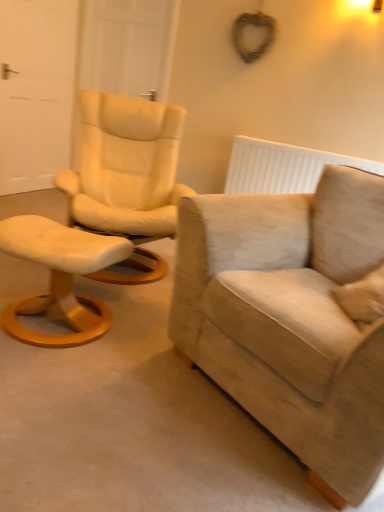
Question: Is white fabric stool at left to the left or to the right of white textured radiator at upper right in the image?

Choices:
 (A) right
 (B) left

Answer: (B)

Question: From the image's perspective, is white fabric stool at left positioned above or below white textured radiator at upper right?

Choices:
 (A) above
 (B) below

Answer: (B)

Question: Estimate the real-world distances between objects in this image. Which object is closer to the white textured radiator at upper right?

Choices:
 (A) white wood door at upper left, which appears as the 2th door when viewed from the left
 (B) white matte door at left, the first door in the left-to-right sequence
 (C) beige fabric armchair at right
 (D) white fabric stool at left

Answer: (A)

Question: Estimate the real-world distances between objects in this image. Which object is closer to the white wood door at upper left, the 1th door positioned from the right?

Choices:
 (A) beige fabric armchair at right
 (B) white matte door at left, marked as the 2th door in a right-to-left arrangement
 (C) white fabric stool at left
 (D) white textured radiator at upper right

Answer: (B)